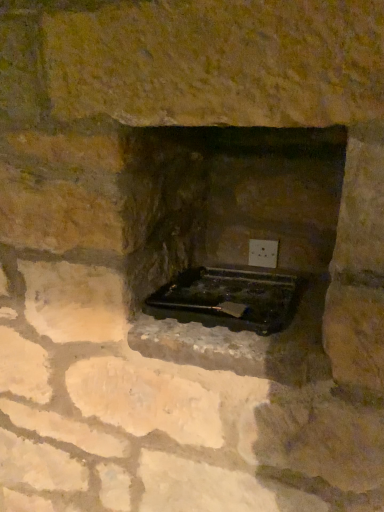
Question: Considering the positions of white plastic electric outlet at center and black plastic tray at center in the image, is white plastic electric outlet at center taller or shorter than black plastic tray at center?

Choices:
 (A) short
 (B) tall

Answer: (B)

Question: Considering the positions of white plastic electric outlet at center and black plastic tray at center in the image, is white plastic electric outlet at center wider or thinner than black plastic tray at center?

Choices:
 (A) thin
 (B) wide

Answer: (A)

Question: Choose the correct answer: Is white plastic electric outlet at center inside black plastic tray at center or outside it?

Choices:
 (A) outside
 (B) inside

Answer: (A)

Question: From a real-world perspective, is black plastic tray at center above or below white plastic electric outlet at center?

Choices:
 (A) above
 (B) below

Answer: (B)

Question: Is black plastic tray at center taller or shorter than white plastic electric outlet at center?

Choices:
 (A) short
 (B) tall

Answer: (A)

Question: From the image's perspective, is black plastic tray at center positioned above or below white plastic electric outlet at center?

Choices:
 (A) below
 (B) above

Answer: (A)

Question: Which is correct: black plastic tray at center is inside white plastic electric outlet at center, or outside of it?

Choices:
 (A) inside
 (B) outside

Answer: (B)